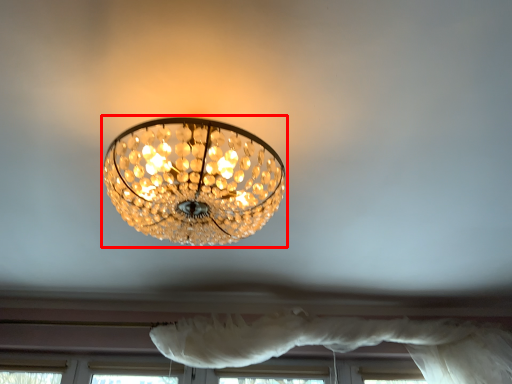
Question: From the image's perspective, what is the correct spatial positioning of lamp (annotated by the red box) in reference to curtain?

Choices:
 (A) above
 (B) below

Answer: (A)